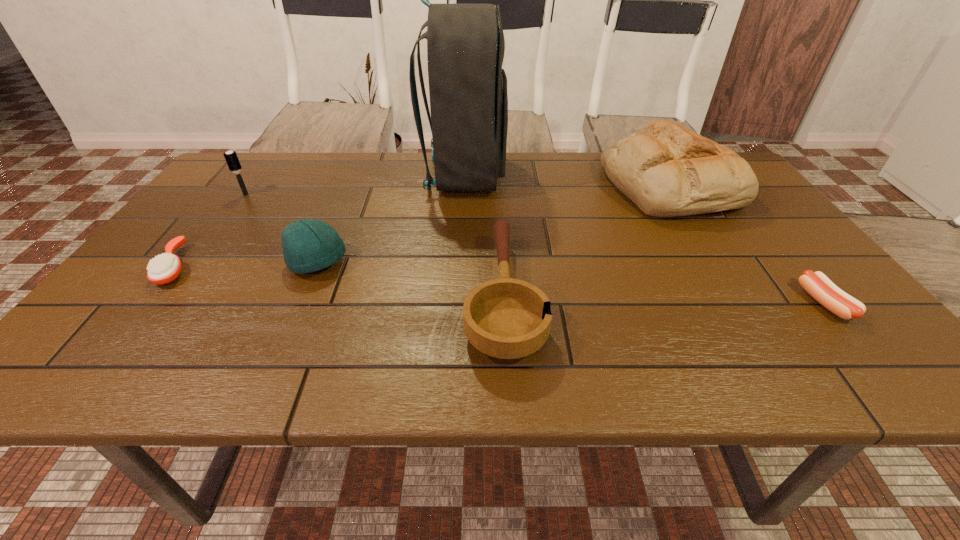
Locate an element on the screen. The width and height of the screenshot is (960, 540). object positioned at the near edge is located at coordinates (506, 318).

Identify the location of bread at the right edge. (666, 170).

The height and width of the screenshot is (540, 960). Identify the location of sausage situated at the right edge. (818, 285).

Locate an element on the screen. The image size is (960, 540). object located in the far right corner section of the desktop is located at coordinates (666, 170).

This screenshot has height=540, width=960. I want to click on free space at the far edge of the desktop, so click(557, 190).

In the image, there is a desktop. At what (x,y) coordinates should I click in order to perform the action: click on free space at the near edge. Please return your answer as a coordinate pair (x, y). This screenshot has width=960, height=540. Looking at the image, I should click on (241, 355).

At what (x,y) coordinates should I click in order to perform the action: click on vacant area at the left edge. Please return your answer as a coordinate pair (x, y). This screenshot has width=960, height=540. Looking at the image, I should click on (140, 342).

Locate an element on the screen. This screenshot has height=540, width=960. vacant area at the far left corner of the desktop is located at coordinates (264, 177).

Locate an element on the screen. The height and width of the screenshot is (540, 960). vacant area between the fourth tallest object and the third tallest object is located at coordinates (282, 228).

The width and height of the screenshot is (960, 540). Identify the location of free spot between the saucepan and the third tallest object. (374, 246).